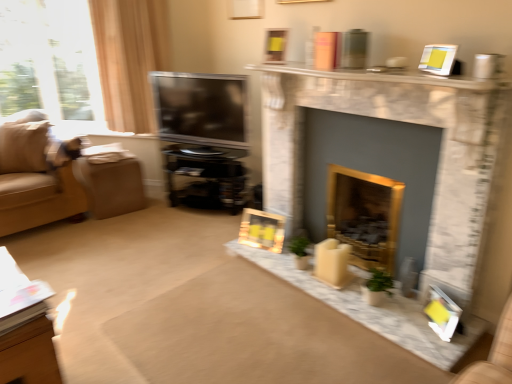
Question: Can you confirm if marble fireplace at center, which appears as the 2th fireplace when viewed from the back, is thinner than suede beige couch at left?

Choices:
 (A) yes
 (B) no

Answer: (A)

Question: Is marble fireplace at center, which appears as the 2th fireplace when viewed from the back, bigger than suede beige couch at left?

Choices:
 (A) yes
 (B) no

Answer: (B)

Question: Would you say suede beige couch at left is part of marble fireplace at center, which appears as the 2th fireplace when viewed from the back,'s contents?

Choices:
 (A) yes
 (B) no

Answer: (B)

Question: Could you tell me if marble fireplace at center, the 1th fireplace in the front-to-back sequence, is turned towards suede beige couch at left?

Choices:
 (A) yes
 (B) no

Answer: (B)

Question: Is marble fireplace at center, which appears as the 2th fireplace when viewed from the back, smaller than suede beige couch at left?

Choices:
 (A) no
 (B) yes

Answer: (B)

Question: Looking at their shapes, would you say matte white picture frame at lower right, the first picture frame positioned from the right, is wider or thinner than marble fireplace at center, the 1th fireplace in the front-to-back sequence?

Choices:
 (A) wide
 (B) thin

Answer: (B)

Question: From a real-world perspective, relative to marble fireplace at center, which appears as the 2th fireplace when viewed from the back, is matte white picture frame at lower right, the first picture frame positioned from the right, vertically above or below?

Choices:
 (A) below
 (B) above

Answer: (A)

Question: Relative to marble fireplace at center, which appears as the 2th fireplace when viewed from the back, is matte white picture frame at lower right, which is counted as the 1th picture frame, starting from the bottom, in front or behind?

Choices:
 (A) front
 (B) behind

Answer: (B)

Question: Considering the positions of point (434, 294) and point (368, 92), is point (434, 294) closer or farther from the camera than point (368, 92)?

Choices:
 (A) closer
 (B) farther

Answer: (A)

Question: Relative to suede beige couch at left, is brown fabric footrest at left in front or behind?

Choices:
 (A) behind
 (B) front

Answer: (A)

Question: From the image's perspective, relative to suede beige couch at left, is brown fabric footrest at left above or below?

Choices:
 (A) below
 (B) above

Answer: (A)

Question: From their relative heights in the image, would you say brown fabric footrest at left is taller or shorter than suede beige couch at left?

Choices:
 (A) short
 (B) tall

Answer: (A)

Question: Would you say brown fabric footrest at left is inside or outside suede beige couch at left?

Choices:
 (A) outside
 (B) inside

Answer: (A)

Question: From a real-world perspective, is black glossy entertainment center at center physically located above or below white marble fireplace at upper center?

Choices:
 (A) below
 (B) above

Answer: (A)

Question: In terms of size, does black glossy entertainment center at center appear bigger or smaller than white marble fireplace at upper center?

Choices:
 (A) big
 (B) small

Answer: (A)